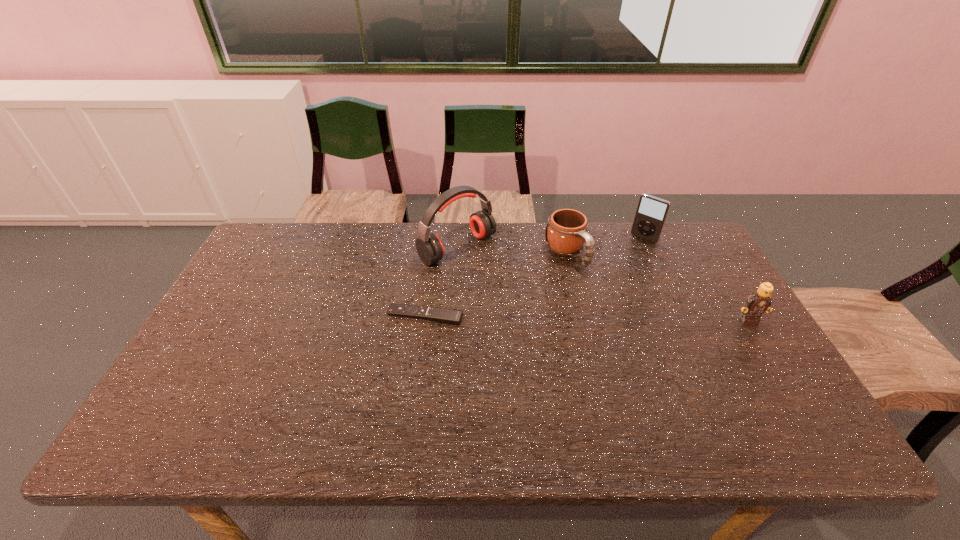
The width and height of the screenshot is (960, 540). Identify the location of free spot on the desktop that is between the shortest object and the rightmost object and is positioned on the side of the third object from left to right with the handle. click(x=629, y=318).

Where is `vacant space on the desktop that is between the remote control and the rightmost object and is positioned on the front-facing side of the second tallest object`? vacant space on the desktop that is between the remote control and the rightmost object and is positioned on the front-facing side of the second tallest object is located at coordinates (580, 318).

This screenshot has width=960, height=540. I want to click on free spot on the desktop that is between the shortest object and the rightmost object and is positioned on the ear cups of the tallest object, so click(541, 317).